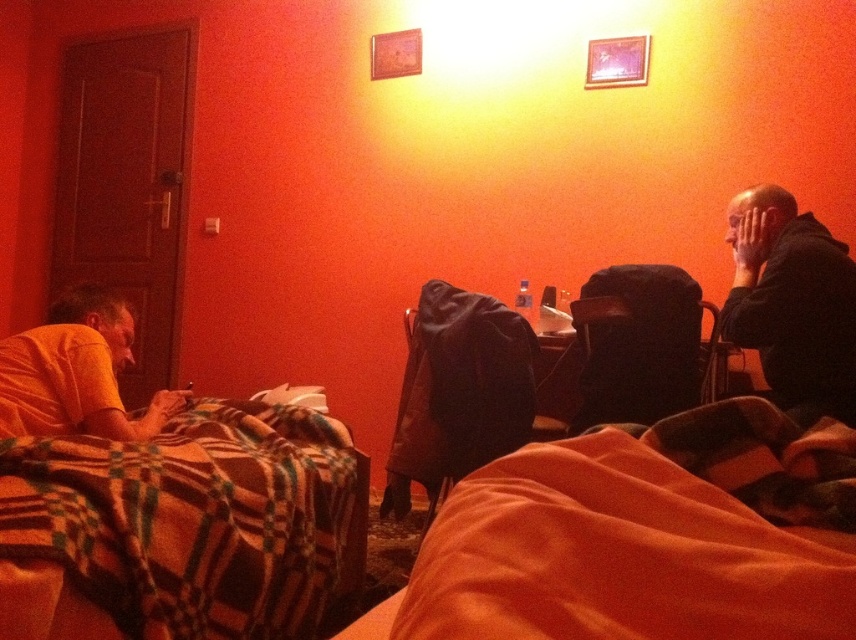
You are a delivery robot with a package that measures 12 inches in length. You need to place the package on the plaid fabric blanket at lower left. Can the package fit on the blanket without exceeding its edges?

The plaid fabric blanket at lower left is 37.65 inches in length, so the 12 inch package can fit on it since it is shorter than the blanket.

You are standing in the room and want to hand a book to the person wearing the yellow cotton shirt at left. Which direction should you move to reach them without passing through the black hoodie at right?

The black hoodie at right is positioned over the yellow cotton shirt at left, so you should move to the left side of the black hoodie at right to reach the yellow cotton shirt at left without passing through the obstacle.